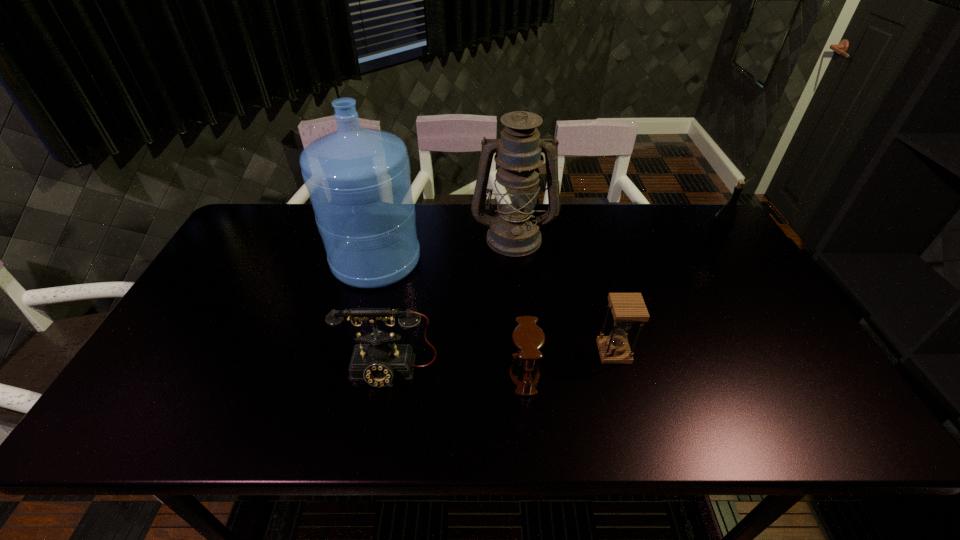
You are a GUI agent. You are given a task and a screenshot of the screen. Output one action in this format:
    pyautogui.click(x=<x>, y=<y>)
    Task: Click on the vacant space at the near edge of the desktop
    
    Given the screenshot: What is the action you would take?
    pyautogui.click(x=349, y=429)

This screenshot has width=960, height=540. I want to click on vacant space at the left edge of the desktop, so click(228, 286).

In the image, there is a desktop. Where is `free space at the right edge`? The image size is (960, 540). free space at the right edge is located at coordinates click(746, 287).

Where is `vacant region at the far left corner of the desktop`? The width and height of the screenshot is (960, 540). vacant region at the far left corner of the desktop is located at coordinates (244, 224).

At what (x,y) coordinates should I click in order to perform the action: click on vacant space at the near left corner of the desktop. Please return your answer as a coordinate pair (x, y). Looking at the image, I should click on (178, 433).

This screenshot has height=540, width=960. I want to click on vacant space at the far right corner of the desktop, so click(x=708, y=212).

Find the location of a particular element. The height and width of the screenshot is (540, 960). free space between the beer bottle and the fifth shortest object is located at coordinates (613, 242).

The height and width of the screenshot is (540, 960). I want to click on vacant space that's between the second tallest object and the water jug, so click(x=444, y=248).

Locate an element on the screen. vacant region between the water jug and the right hourglass is located at coordinates (494, 306).

At what (x,y) coordinates should I click in order to perform the action: click on free space between the oil lamp and the rightmost object. Please return your answer as a coordinate pair (x, y). Looking at the image, I should click on (613, 242).